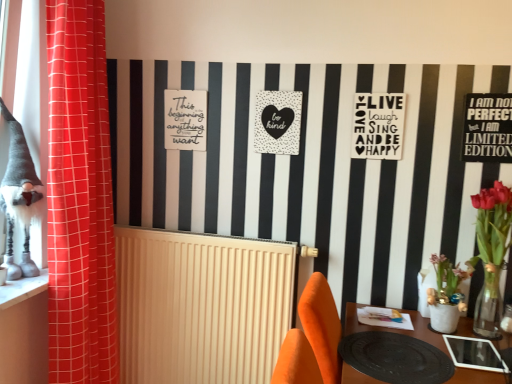
Question: Could white matte poster at upper center, marked as the 2th postcard in a left-to-right arrangement, be considered to be inside black matte sign at upper right, marked as the third postcard in a left-to-right arrangement?

Choices:
 (A) yes
 (B) no

Answer: (B)

Question: Can you confirm if black matte sign at upper right, marked as the third postcard in a left-to-right arrangement, is smaller than white matte poster at upper center, which appears as the 2th postcard when viewed from the front?

Choices:
 (A) no
 (B) yes

Answer: (A)

Question: Is black matte sign at upper right, the 1th postcard from the right, bigger than white matte poster at upper center, positioned as the second postcard in right-to-left order?

Choices:
 (A) yes
 (B) no

Answer: (A)

Question: Is black matte sign at upper right, the 1th postcard from the right, facing away from white matte poster at upper center, which appears as the 2th postcard when viewed from the front?

Choices:
 (A) no
 (B) yes

Answer: (A)

Question: Can you confirm if black matte sign at upper right, the third postcard in the back-to-front sequence, is taller than white matte poster at upper center, positioned as the second postcard in right-to-left order?

Choices:
 (A) yes
 (B) no

Answer: (A)

Question: Does black matte sign at upper right, the third postcard in the back-to-front sequence, appear on the right side of white matte poster at upper center, which appears as the 2th postcard when viewed from the front?

Choices:
 (A) yes
 (B) no

Answer: (A)

Question: Does white ribbed radiator at center have a lesser width compared to black dotted heart at center, placed as the third postcard when sorted from front to back?

Choices:
 (A) no
 (B) yes

Answer: (A)

Question: Does white ribbed radiator at center have a greater height compared to black dotted heart at center, the third postcard viewed from the right?

Choices:
 (A) yes
 (B) no

Answer: (A)

Question: Does white ribbed radiator at center have a lesser height compared to black dotted heart at center, placed as the third postcard when sorted from front to back?

Choices:
 (A) no
 (B) yes

Answer: (A)

Question: Can you confirm if white ribbed radiator at center is wider than black dotted heart at center, the 1th postcard from the left?

Choices:
 (A) no
 (B) yes

Answer: (B)

Question: Is white ribbed radiator at center at the left side of black dotted heart at center, the 1th postcard from the left?

Choices:
 (A) no
 (B) yes

Answer: (B)

Question: Can you confirm if white ribbed radiator at center is bigger than black dotted heart at center, the 1th postcard in the back-to-front sequence?

Choices:
 (A) yes
 (B) no

Answer: (A)

Question: Is black matte table at lower right located outside black matte sign at upper right, the 1th postcard from the right?

Choices:
 (A) no
 (B) yes

Answer: (B)